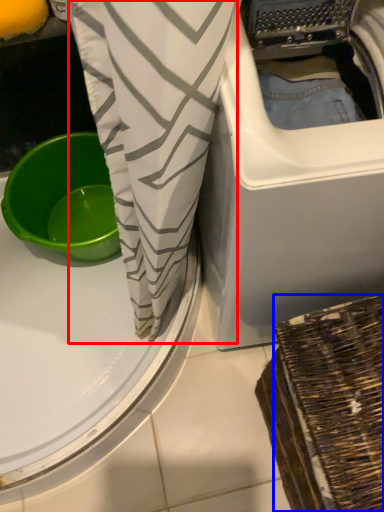
Question: Which object appears closest to the camera in this image, clothing (highlighted by a red box) or basket (highlighted by a blue box)?

Choices:
 (A) clothing
 (B) basket

Answer: (B)